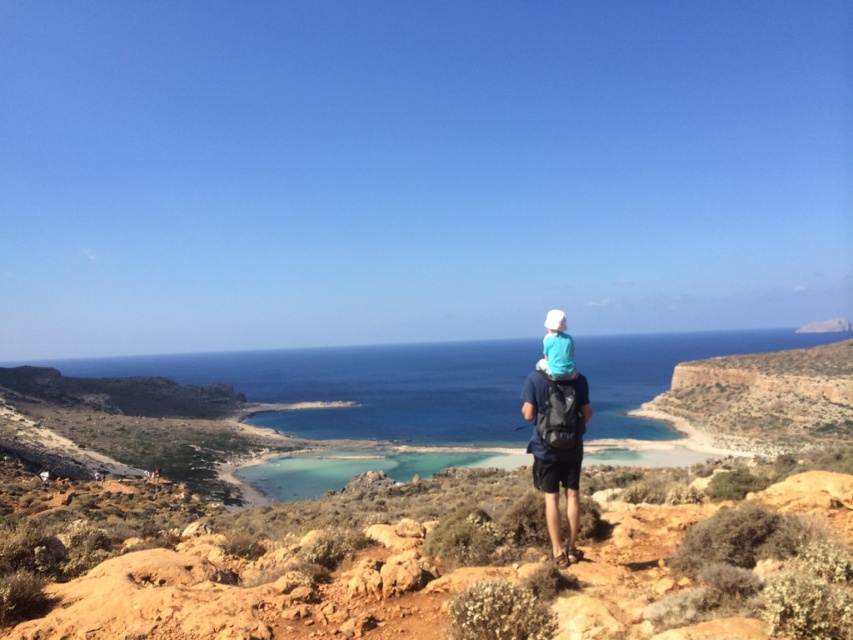
You are standing at the rugged terrain in the foreground of the coastal landscape. You see two points marked in the scene. Which point is closer to you, point (627, 401) or point (550, 509)?

Point (627, 401) is closer to you because it is further to the viewer than point (550, 509).

You are standing at the point labeled point (581, 420) and want to walk to the point labeled point (550, 352). Which direction should you face to move towards your destination?

To move from point (581, 420) to point (550, 352), you should face towards the direction away from the viewer since point (550, 352) is farther from the viewer compared to point (581, 420).

You are a hiker planning to walk from your current position to the clear blue water at center. There is a white matte hat at center in your path. Which object will you encounter first?

You will encounter the white matte hat at center first because it is closer to you than the clear blue water at center, which is further away.